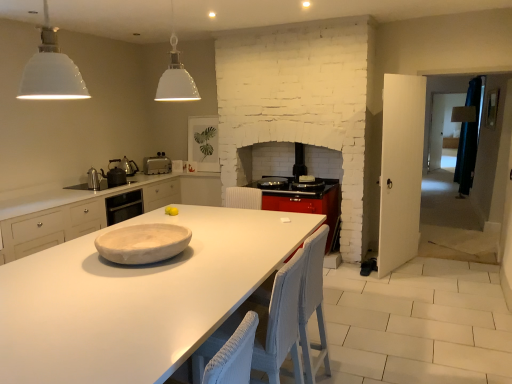
The height and width of the screenshot is (384, 512). Identify the location of free region under white matte pendant light at upper left, the first light fixture positioned from the left (from a real-world perspective). (76, 294).